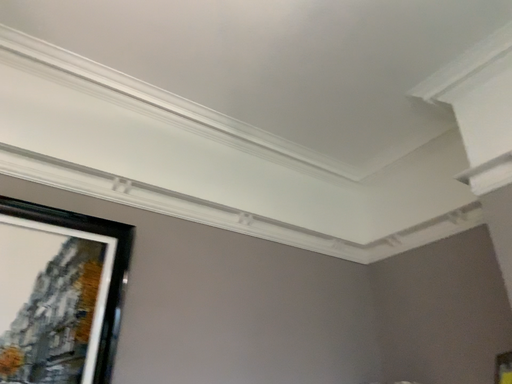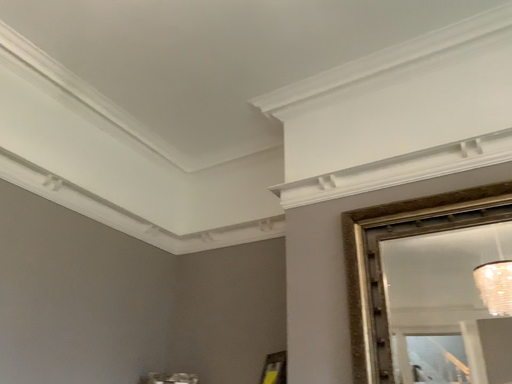
Question: Which way did the camera rotate in the video?

Choices:
 (A) rotated left
 (B) rotated right

Answer: (B)